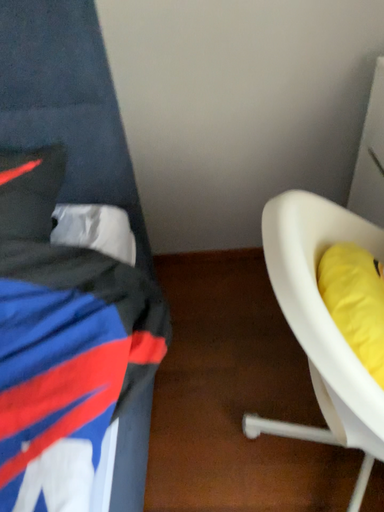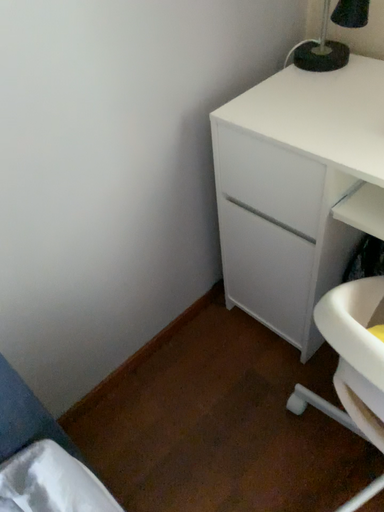
Question: How did the camera likely rotate when shooting the video?

Choices:
 (A) rotated upward
 (B) rotated downward

Answer: (A)